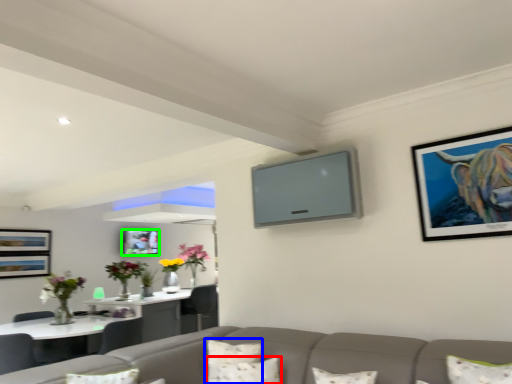
Question: Which object is positioned closest to pillow (highlighted by a red box)? Select from pillow (highlighted by a blue box) and picture frame (highlighted by a green box).

Choices:
 (A) pillow
 (B) picture frame

Answer: (A)